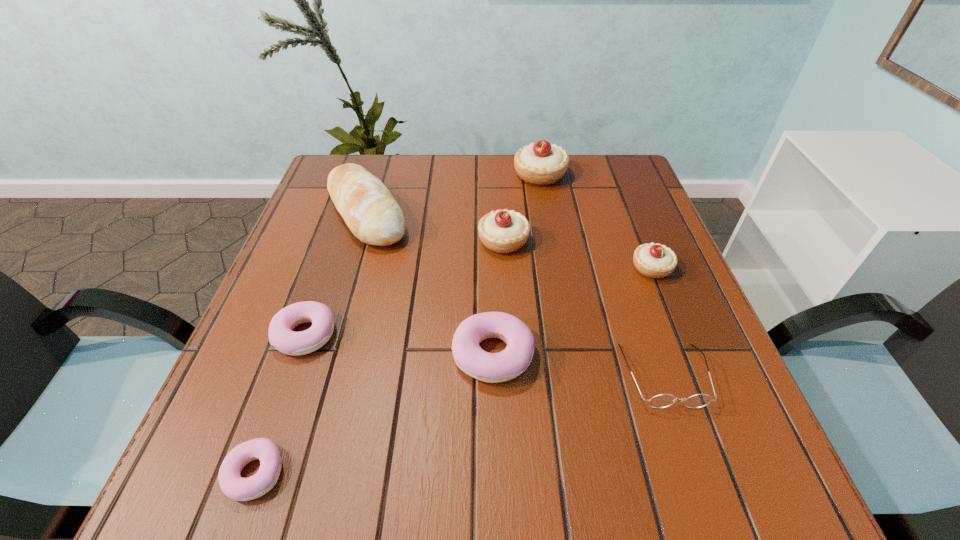
Identify the location of the biggest beige pastry. The height and width of the screenshot is (540, 960). pyautogui.click(x=540, y=163).

Where is `the farthest pastry`? the farthest pastry is located at coordinates (x=540, y=163).

Find the location of a particular element. The width and height of the screenshot is (960, 540). beige bread is located at coordinates (368, 208).

I want to click on the sixth shortest object, so click(x=505, y=231).

Where is `the second tallest pastry`? This screenshot has height=540, width=960. the second tallest pastry is located at coordinates (505, 231).

Find the location of `the fourth shortest pastry`. the fourth shortest pastry is located at coordinates (652, 260).

You are a GUI agent. You are given a task and a screenshot of the screen. Output one action in this format:
    pyautogui.click(x=<x>, y=<y>)
    Task: Click on the fourth tallest object
    The height and width of the screenshot is (540, 960).
    Given the screenshot: What is the action you would take?
    pyautogui.click(x=652, y=260)

Find the location of `the rightmost pink pastry`. the rightmost pink pastry is located at coordinates (508, 364).

Identify the location of the fifth tallest object. This screenshot has width=960, height=540. (508, 364).

In order to click on the fifth tallest pastry in this screenshot , I will do `click(281, 336)`.